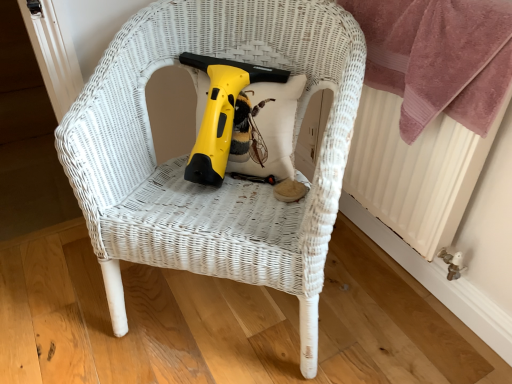
The width and height of the screenshot is (512, 384). What do you see at coordinates (185, 158) in the screenshot? I see `white wicker chair at center` at bounding box center [185, 158].

What do you see at coordinates (415, 170) in the screenshot? I see `white textured radiator at right` at bounding box center [415, 170].

Where is `pink plush towel at upper right`? This screenshot has height=384, width=512. pink plush towel at upper right is located at coordinates (438, 57).

Which is more to the right, white textured radiator at right or yellow plastic electric drill at center?

white textured radiator at right is more to the right.

Considering the sizes of white textured radiator at right and yellow plastic electric drill at center in the image, is white textured radiator at right wider or thinner than yellow plastic electric drill at center?

Clearly, white textured radiator at right has less width compared to yellow plastic electric drill at center.

Considering the relative sizes of white textured radiator at right and yellow plastic electric drill at center in the image provided, is white textured radiator at right taller than yellow plastic electric drill at center?

Indeed, white textured radiator at right has a greater height compared to yellow plastic electric drill at center.

From a real-world perspective, is white textured radiator at right positioned above or below yellow plastic electric drill at center?

Clearly, from a real-world perspective, white textured radiator at right is below yellow plastic electric drill at center.

Is pink plush towel at upper right facing away from white wicker chair at center?

pink plush towel at upper right is not turned away from white wicker chair at center.

Are pink plush towel at upper right and white wicker chair at center making contact?

No, pink plush towel at upper right is not with white wicker chair at center.

From the picture: From the image's perspective, which is above, pink plush towel at upper right or white wicker chair at center?

From the image's view, pink plush towel at upper right is above.

Choose the correct answer: Is yellow plastic electric drill at center inside white textured radiator at right or outside it?

yellow plastic electric drill at center lies outside white textured radiator at right.

You are a GUI agent. You are given a task and a screenshot of the screen. Output one action in this format:
    pyautogui.click(x=<x>, y=<y>)
    Task: Click on the radiator located in front of the yellow plastic electric drill at center
    This screenshot has width=512, height=384.
    Given the screenshot: What is the action you would take?
    pyautogui.click(x=415, y=170)

From the picture: Could you tell me if pink plush towel at upper right is facing yellow plastic electric drill at center?

Yes, pink plush towel at upper right is facing yellow plastic electric drill at center.

Between pink plush towel at upper right and yellow plastic electric drill at center, which one is positioned in front?

pink plush towel at upper right is closer to the camera.

Can we say pink plush towel at upper right lies outside yellow plastic electric drill at center?

Absolutely, pink plush towel at upper right is external to yellow plastic electric drill at center.

Who is taller, pink plush towel at upper right or yellow plastic electric drill at center?

pink plush towel at upper right.

Which is in front, white textured radiator at right or white wicker chair at center?

Positioned in front is white wicker chair at center.

Which is more to the left, white textured radiator at right or white wicker chair at center?

white wicker chair at center is more to the left.

From a real-world perspective, is white textured radiator at right below white wicker chair at center?

Actually, white textured radiator at right is physically above white wicker chair at center in the real world.

Based on the photo, from a real-world perspective, does white wicker chair at center sit lower than yellow plastic electric drill at center?

Yes, from a real-world perspective, white wicker chair at center is below yellow plastic electric drill at center.

From the image's perspective, would you say white wicker chair at center is shown under yellow plastic electric drill at center?

Correct, white wicker chair at center appears lower than yellow plastic electric drill at center in the image.

Does white wicker chair at center appear on the right side of yellow plastic electric drill at center?

Correct, you'll find white wicker chair at center to the right of yellow plastic electric drill at center.

Is white wicker chair at center placed right next to yellow plastic electric drill at center?

There is a gap between white wicker chair at center and yellow plastic electric drill at center.

From a real-world perspective, who is located higher, white wicker chair at center or white textured radiator at right?

In real-world perspective, white textured radiator at right is above.

Is white textured radiator at right at the back of white wicker chair at center?

That's not correct — white wicker chair at center is not looking away from white textured radiator at right.

What's the angular difference between white wicker chair at center and white textured radiator at right's facing directions?

The angle between the facing direction of white wicker chair at center and the facing direction of white textured radiator at right is 44.3 degrees.

Considering the sizes of objects white wicker chair at center and white textured radiator at right in the image provided, who is shorter, white wicker chair at center or white textured radiator at right?

white textured radiator at right.

In the image, there is a white textured radiator at right. Where is `electric drill above it (from the image's perspective)`? The image size is (512, 384). electric drill above it (from the image's perspective) is located at coordinates (226, 116).

Where is `chair that appears on the left of pink plush towel at upper right`? The image size is (512, 384). chair that appears on the left of pink plush towel at upper right is located at coordinates (185, 158).

Estimate the real-world distances between objects in this image. Which object is closer to pink plush towel at upper right, white textured radiator at right or white wicker chair at center?

white textured radiator at right lies closer to pink plush towel at upper right than the other object.

Which object lies nearer to the anchor point white wicker chair at center, white textured radiator at right or pink plush towel at upper right?

Based on the image, pink plush towel at upper right appears to be nearer to white wicker chair at center.

Based on their spatial positions, is white textured radiator at right or yellow plastic electric drill at center closer to pink plush towel at upper right?

Among the two, white textured radiator at right is located nearer to pink plush towel at upper right.

Which object lies nearer to the anchor point white wicker chair at center, yellow plastic electric drill at center or pink plush towel at upper right?

yellow plastic electric drill at center is positioned closer to the anchor white wicker chair at center.

Considering their positions, is white textured radiator at right positioned further to yellow plastic electric drill at center than pink plush towel at upper right?

white textured radiator at right.

Estimate the real-world distances between objects in this image. Which object is closer to yellow plastic electric drill at center, white wicker chair at center or white textured radiator at right?

white wicker chair at center.

Considering their positions, is yellow plastic electric drill at center positioned further to pink plush towel at upper right than white wicker chair at center?

Based on the image, yellow plastic electric drill at center appears to be further to pink plush towel at upper right.

From the image, which object appears to be nearer to white textured radiator at right, white wicker chair at center or pink plush towel at upper right?

Based on the image, pink plush towel at upper right appears to be nearer to white textured radiator at right.

Identify the location of blanket located between yellow plastic electric drill at center and white textured radiator at right in the left-right direction. (438, 57).

This screenshot has width=512, height=384. Find the location of `chair located between yellow plastic electric drill at center and pink plush towel at upper right in the left-right direction`. chair located between yellow plastic electric drill at center and pink plush towel at upper right in the left-right direction is located at coordinates (185, 158).

In order to click on chair located between yellow plastic electric drill at center and white textured radiator at right in the left-right direction in this screenshot , I will do `click(185, 158)`.

Where is `blanket situated between white wicker chair at center and white textured radiator at right from left to right`? The image size is (512, 384). blanket situated between white wicker chair at center and white textured radiator at right from left to right is located at coordinates (438, 57).